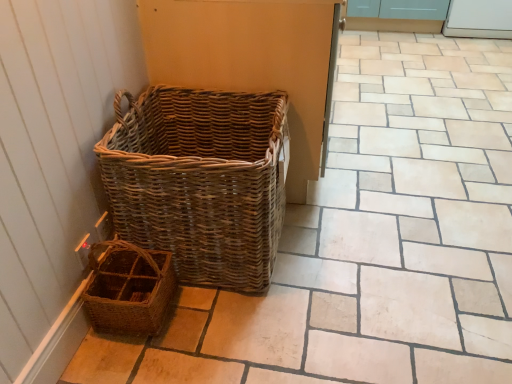
What are the coordinates of `vacant space to the right of brown woven picnic basket at lower left, acting as the 1th picnic basket starting from the bottom` in the screenshot? It's located at [206, 324].